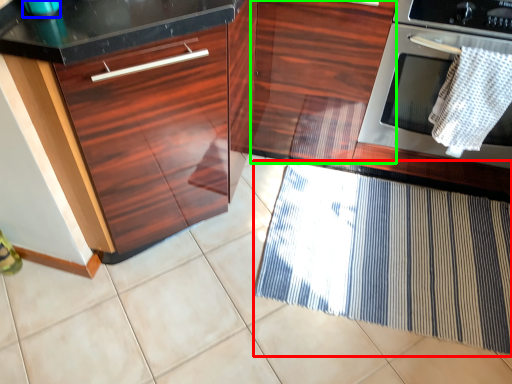
Question: Estimate the real-world distances between objects in this image. Which object is closer to doormat (highlighted by a red box), appliance (highlighted by a blue box) or cabinetry (highlighted by a green box)?

Choices:
 (A) appliance
 (B) cabinetry

Answer: (B)